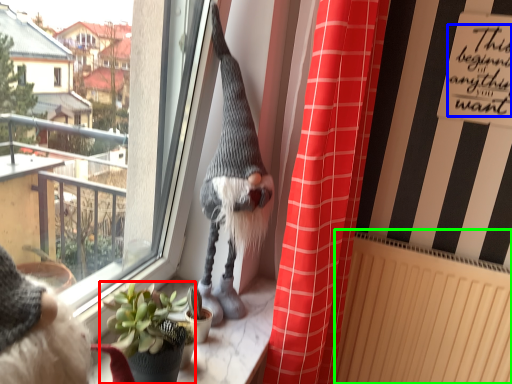
Question: Based on their relative distances, which object is farther from houseplant (highlighted by a red box)? Choose from writing (highlighted by a blue box) and radiator (highlighted by a green box).

Choices:
 (A) writing
 (B) radiator

Answer: (A)